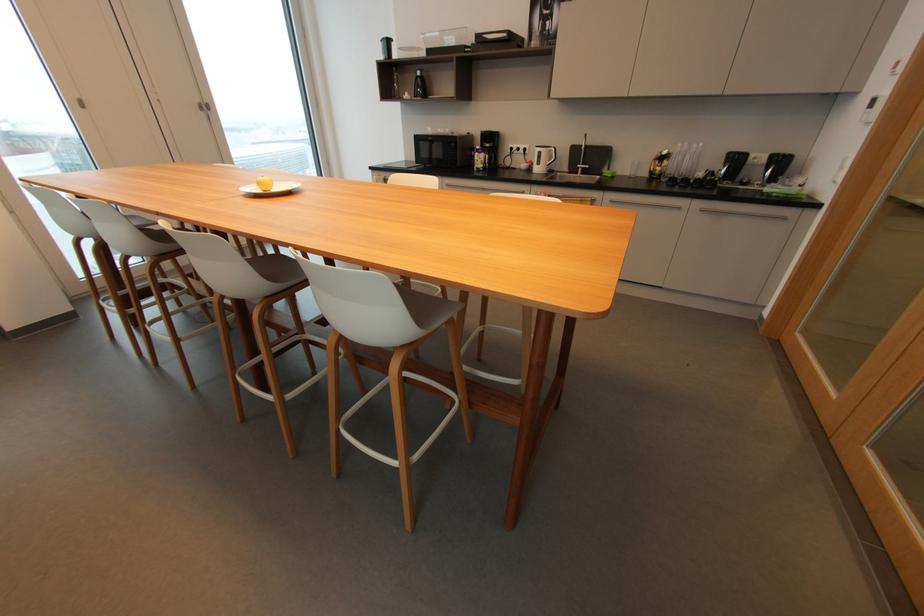
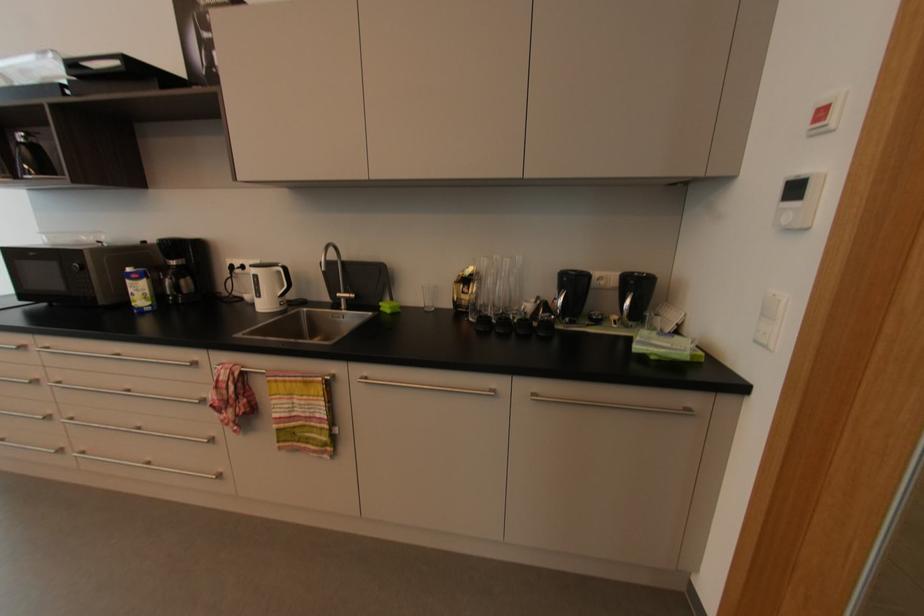
Where in the second image is the point corresponding to point 839,182 from the first image?

(769, 347)